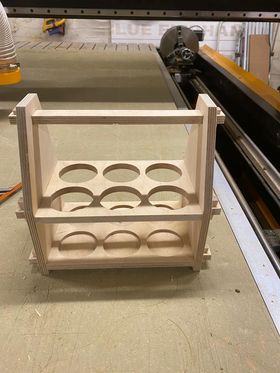
Locate an element on the screen. The height and width of the screenshot is (373, 280). light brown flat surface is located at coordinates (160, 333).